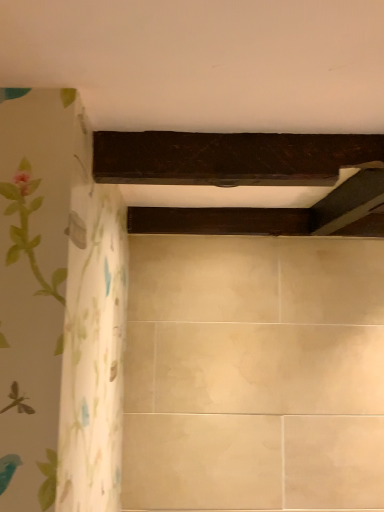
In order to face dark wood plank at upper center, should I rotate leftwards or rightwards?

Rotate right and turn 6.931 degrees.

You are a GUI agent. You are given a task and a screenshot of the screen. Output one action in this format:
    pyautogui.click(x=<x>, y=<y>)
    Task: Click on the dark wood plank at upper center
    This screenshot has width=384, height=512.
    Given the screenshot: What is the action you would take?
    pyautogui.click(x=230, y=158)

The width and height of the screenshot is (384, 512). Describe the element at coordinates (230, 158) in the screenshot. I see `dark wood plank at upper center` at that location.

Measure the distance between point (356, 143) and camera.

34.49 inches.

I want to click on dark wood plank at upper center, so click(230, 158).